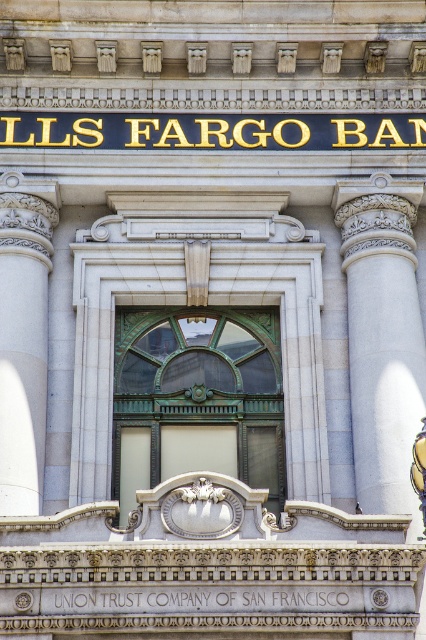
You are an architect reviewing the building facade and need to determine the position of the gold metallic sign at upper center relative to the decorative window below it. Is the sign positioned above or below the window?

The gold metallic sign at upper center is located above the decorative window since it is positioned at point coordinates that place it higher up in the image.

From the picture: You are an architect examining the building facade. You notice the white marble column at left and the black stone text at center. Which object appears closer to you from your viewing position?

The white marble column at left appears closer because the black stone text at center is positioned behind it.

You are an architect reviewing the building facade. You need to determine which object is taller between the white marble column at right and the gold metallic sign at upper center. Based on the provided information, which one is taller?

The white marble column at right has a greater height compared to the gold metallic sign at upper center, so the white marble column at right is taller.